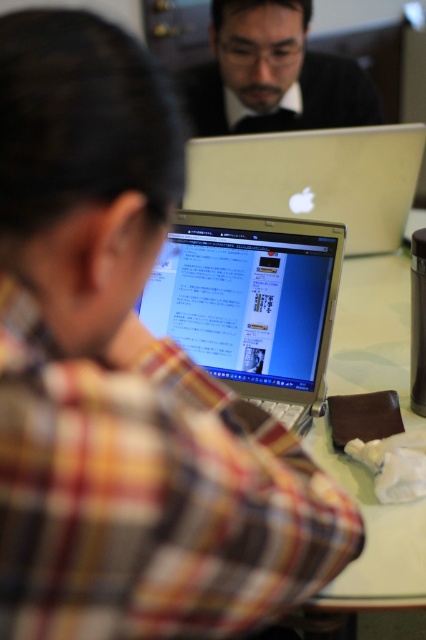
Does silver metallic laptop at center appear on the right side of silver metallic laptop at upper center?

In fact, silver metallic laptop at center is to the left of silver metallic laptop at upper center.

How far apart are silver metallic laptop at center and silver metallic laptop at upper center?

17.53 inches

Does point (252, 227) come closer to viewer compared to point (356, 180)?

Yes.

Locate an element on the screen. This screenshot has height=640, width=426. silver metallic laptop at center is located at coordinates (252, 305).

Who is shorter, silver metallic laptop at center or matte black laptop at upper center?

Standing shorter between the two is matte black laptop at upper center.

Does silver metallic laptop at center have a lesser height compared to matte black laptop at upper center?

Incorrect, silver metallic laptop at center's height does not fall short of matte black laptop at upper center's.

Is point (252, 328) positioned before point (244, 13)?

Yes, it is.

At what (x,y) coordinates should I click in order to perform the action: click on silver metallic laptop at center. Please return your answer as a coordinate pair (x, y). Looking at the image, I should click on (252, 305).

Can you confirm if silver metallic laptop at upper center is positioned above matte black laptop at upper center?

Incorrect, silver metallic laptop at upper center is not positioned above matte black laptop at upper center.

The image size is (426, 640). What do you see at coordinates (313, 179) in the screenshot?
I see `silver metallic laptop at upper center` at bounding box center [313, 179].

Find the location of `silver metallic laptop at upper center`. silver metallic laptop at upper center is located at coordinates (313, 179).